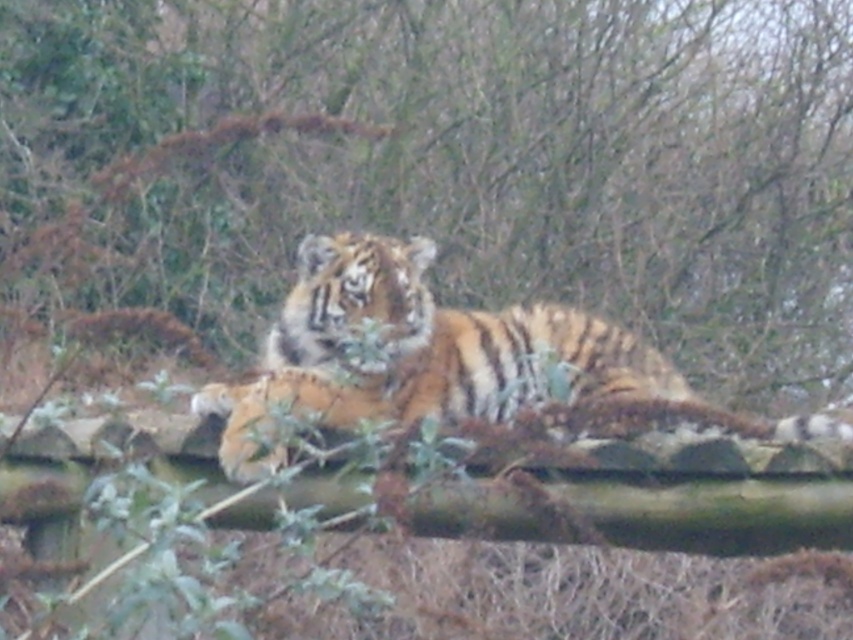
You are a wildlife photographer aiming to capture a closeup shot of the orange striped tiger at center without including the brown textured log at center in the frame. Given the current composition, is it possible to adjust your camera angle to exclude the log while still focusing on the tiger?

The brown textured log at center is wider than the orange striped tiger at center. Since the log is wider, adjusting the camera angle might be challenging, but if the log is positioned directly behind or in front of the tiger, you could shift the camera slightly to one side to exclude the log while keeping the tiger in focus.

Consider the image. You are a photographer who wants to capture the orange striped tiger at center and the brown textured log at center in a single frame. Which object should you focus on to ensure both are in focus if your camera has a limited depth of field?

The brown textured log at center has a greater height compared to orange striped tiger at center, so you should focus on the brown textured log at center to ensure both are in focus.